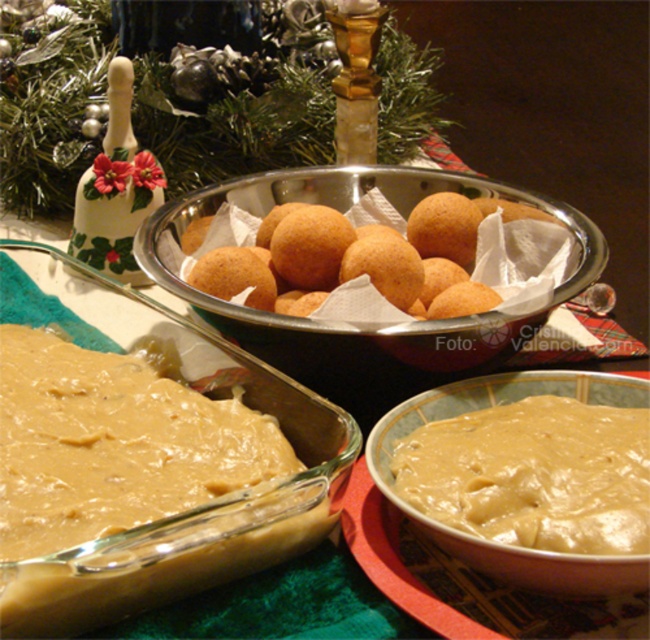
In the scene shown: You are a chef holding a spoon that is 6 inches long. You want to reach the smooth beige paste at lower left to taste it. Can you reach it with your spoon without moving your hand?

The smooth beige paste at lower left and viewer are 5.70 inches apart, so yes, the spoon can reach it since it is slightly longer than the distance between the viewer and the paste.

You are standing in front of the table with the festive food spread. There are two points marked on the table. The first point is at coordinates point [127,538] and the second point is at point [456,305]. Which point is closer to you?

Point [127,538] is closer to the viewer than point [456,305].

You are a guest at a holiday gathering and see the smooth beige paste at lower left and the golden crispy balls at center on the table. Which item is located to the right of the other?

The golden crispy balls at center are located to the right of the smooth beige paste at lower left.